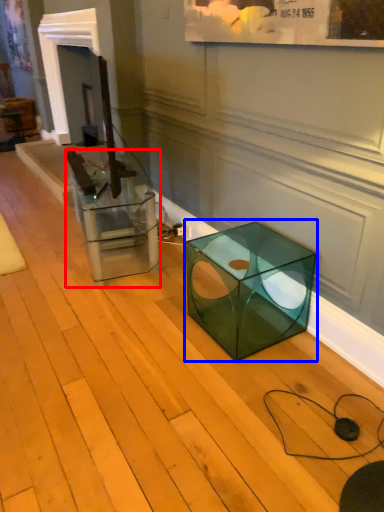
Question: Among these objects, which one is farthest to the camera, glass box (highlighted by a red box) or table (highlighted by a blue box)?

Choices:
 (A) glass box
 (B) table

Answer: (A)